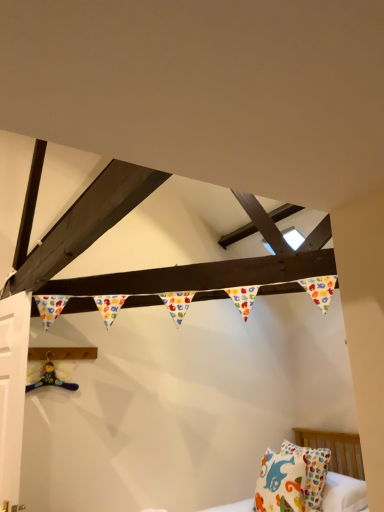
Question: Is white matte door at left turned away from white cotton pillow with colorful patterns at lower right?

Choices:
 (A) no
 (B) yes

Answer: (B)

Question: Is white cotton pillow with colorful patterns at lower right located within white matte door at left?

Choices:
 (A) no
 (B) yes

Answer: (A)

Question: From the image's perspective, is white matte door at left on white cotton pillow with colorful patterns at lower right?

Choices:
 (A) no
 (B) yes

Answer: (B)

Question: Can you confirm if white matte door at left is smaller than white cotton pillow with colorful patterns at lower right?

Choices:
 (A) no
 (B) yes

Answer: (B)

Question: Is white matte door at left next to white cotton pillow with colorful patterns at lower right and touching it?

Choices:
 (A) no
 (B) yes

Answer: (A)

Question: From their relative heights in the image, would you say white cotton pillow with colorful patterns at lower right is taller or shorter than multicolored plush toy at lower left?

Choices:
 (A) short
 (B) tall

Answer: (B)

Question: Is white cotton pillow with colorful patterns at lower right spatially inside multicolored plush toy at lower left, or outside of it?

Choices:
 (A) inside
 (B) outside

Answer: (B)

Question: Considering their positions, is white cotton pillow with colorful patterns at lower right located in front of or behind multicolored plush toy at lower left?

Choices:
 (A) behind
 (B) front

Answer: (B)

Question: Considering the positions of point (294, 493) and point (67, 388), is point (294, 493) closer or farther from the camera than point (67, 388)?

Choices:
 (A) closer
 (B) farther

Answer: (A)

Question: From the image's perspective, is white matte door at left located above or below white cotton pillow with colorful patterns at lower right?

Choices:
 (A) below
 (B) above

Answer: (B)

Question: From a real-world perspective, is white matte door at left physically located above or below white cotton pillow with colorful patterns at lower right?

Choices:
 (A) above
 (B) below

Answer: (A)

Question: Based on their sizes in the image, would you say white matte door at left is bigger or smaller than white cotton pillow with colorful patterns at lower right?

Choices:
 (A) big
 (B) small

Answer: (B)

Question: In terms of height, does white matte door at left look taller or shorter compared to white cotton pillow with colorful patterns at lower right?

Choices:
 (A) short
 (B) tall

Answer: (B)

Question: From a real-world perspective, is multicolored plush toy at lower left physically located above or below white cotton pillow with colorful patterns at lower right?

Choices:
 (A) above
 (B) below

Answer: (A)

Question: Does point (49, 353) appear closer or farther from the camera than point (319, 488)?

Choices:
 (A) closer
 (B) farther

Answer: (A)